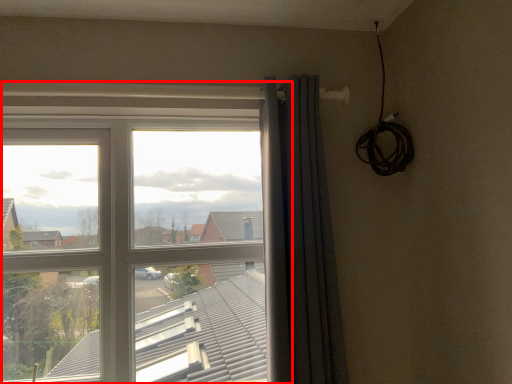
Question: From the image's perspective, what is the correct spatial relationship of window (annotated by the red box) in relation to curtain?

Choices:
 (A) above
 (B) below

Answer: (B)